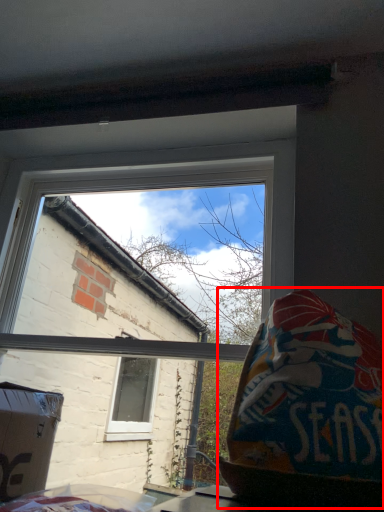
Question: From the image's perspective, considering the relative positions of bean bag chair (annotated by the red box) and window in the image provided, where is bean bag chair (annotated by the red box) located with respect to the staircase?

Choices:
 (A) above
 (B) below

Answer: (B)